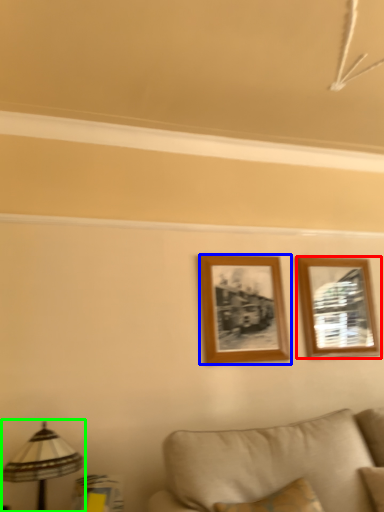
Question: Which object is positioned farthest from picture frame (highlighted by a red box)? Select from picture frame (highlighted by a blue box) and table lamp (highlighted by a green box).

Choices:
 (A) picture frame
 (B) table lamp

Answer: (B)